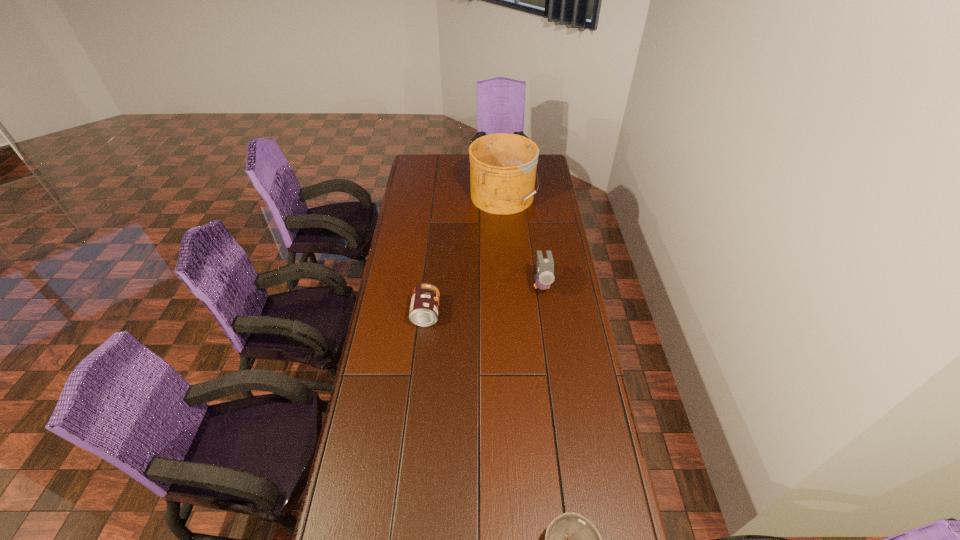
Where is `bucket present at the right edge`? This screenshot has width=960, height=540. bucket present at the right edge is located at coordinates (503, 166).

Locate an element on the screen. This screenshot has height=540, width=960. bird that is at the right edge is located at coordinates point(545,266).

Where is `free region at the far edge of the desktop`? The image size is (960, 540). free region at the far edge of the desktop is located at coordinates (453, 158).

Find the location of a particular element. The height and width of the screenshot is (540, 960). vacant space at the left edge of the desktop is located at coordinates (379, 344).

Find the location of a particular element. vacant space at the right edge of the desktop is located at coordinates (612, 474).

I want to click on vacant space at the far left corner of the desktop, so click(x=411, y=172).

What are the coordinates of `empty location between the farthest object and the third tallest object` in the screenshot? It's located at click(x=465, y=255).

Identify the location of blank region between the third tallest object and the farthest object. The width and height of the screenshot is (960, 540). (465, 255).

Locate an element on the screen. empty location between the second farthest object and the can is located at coordinates (484, 299).

Image resolution: width=960 pixels, height=540 pixels. Identify the location of unoccupied area between the bird and the leftmost object. (484, 299).